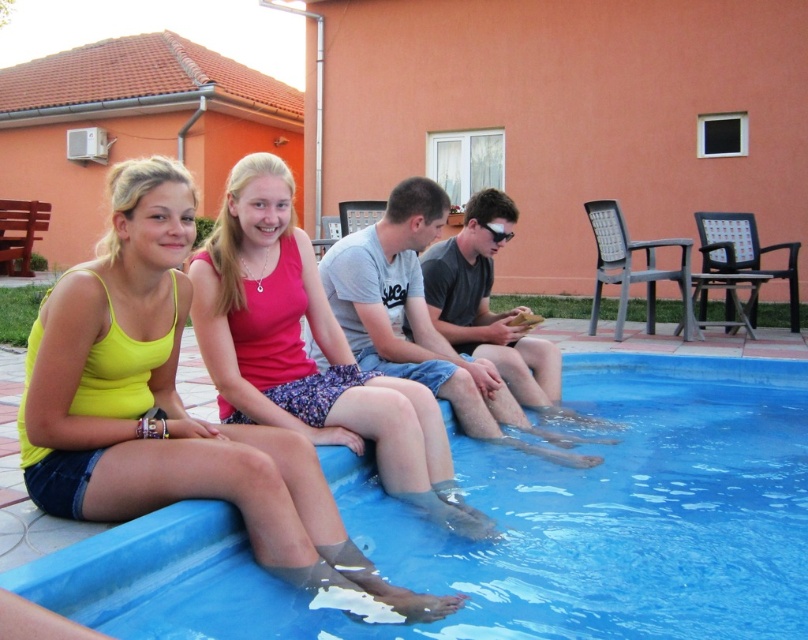
Question: Estimate the real-world distances between objects in this image. Which object is farther from the transparent plastic goggles at center?

Choices:
 (A) blue plastic pool at lower center
 (B) pink fabric dress at center
 (C) yellow matte tank top at upper left

Answer: (C)

Question: Can you confirm if pink fabric dress at center is positioned to the left of transparent plastic goggles at center?

Choices:
 (A) yes
 (B) no

Answer: (A)

Question: Can you confirm if pink fabric dress at center is positioned to the right of transparent plastic goggles at center?

Choices:
 (A) yes
 (B) no

Answer: (B)

Question: Does pink fabric dress at center appear over transparent plastic goggles at center?

Choices:
 (A) yes
 (B) no

Answer: (B)

Question: Which object is closer to the camera taking this photo?

Choices:
 (A) transparent plastic goggles at center
 (B) blue plastic pool at lower center

Answer: (B)

Question: Which object is closer to the camera taking this photo?

Choices:
 (A) pink fabric dress at center
 (B) blue plastic pool at lower center
 (C) transparent plastic goggles at center
 (D) yellow matte tank top at upper left

Answer: (B)